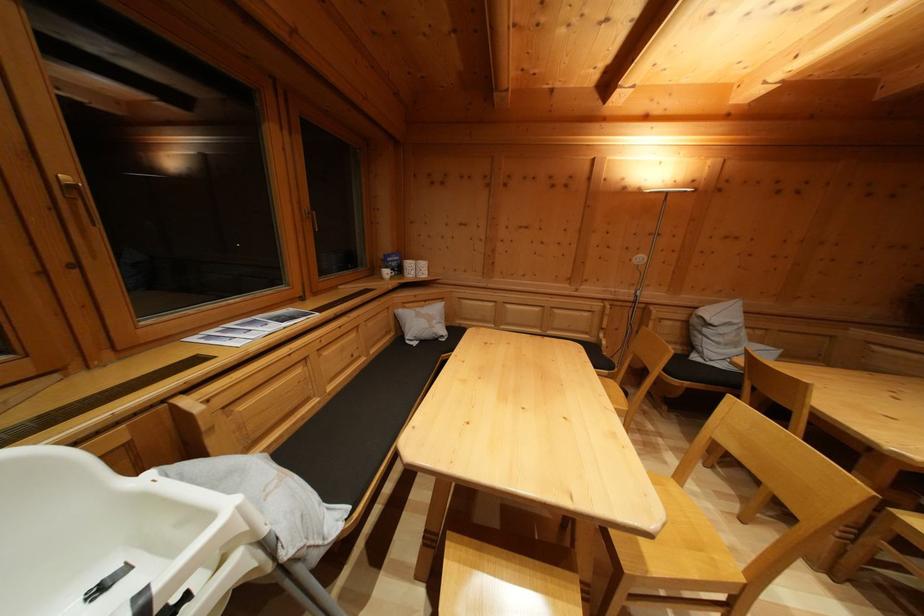
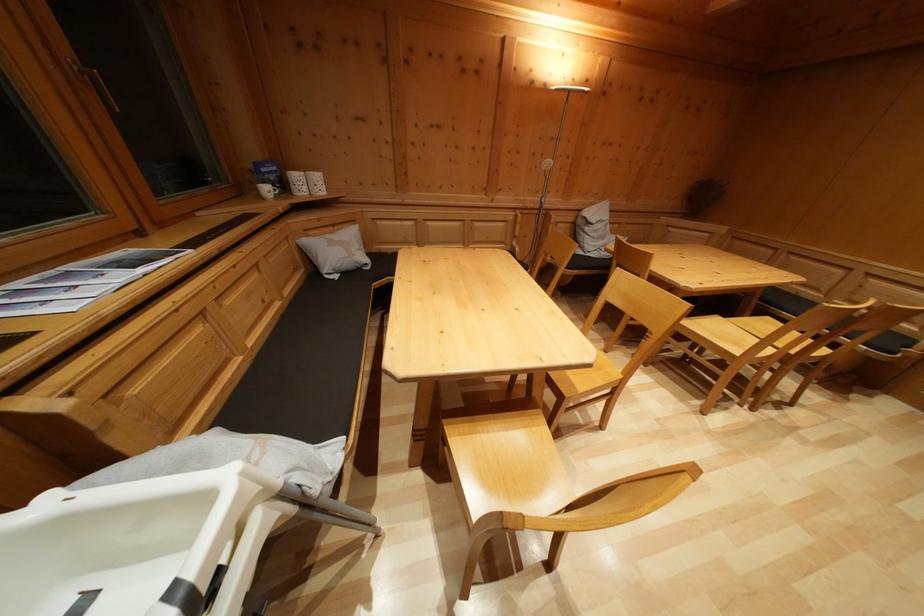
Find the pixel in the second image that matches pixel 578 576 in the first image.

(541, 415)